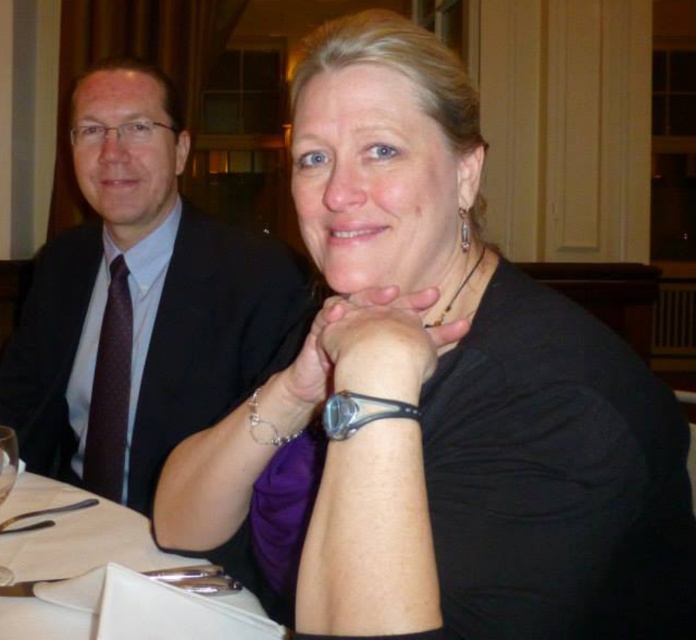
You are a photographer adjusting your camera settings to capture the scene. You notice the brown dotted tie at left and the silver metallic bracelet at lower center. Which object is located more to the left in the image?

The brown dotted tie at left is positioned on the left side of the silver metallic bracelet at lower center, so it is more to the left.

You are a fashion designer observing the formal attire of the person on the left. Which item, the matte black suit at left or the brown dotted tie at left, has a greater width?

The matte black suit at left has a greater width than the brown dotted tie at left according to the description.

You are a photographer standing behind the table. You want to take a photo that includes both the matte black suit at left and the black leather watch at center. What is the minimum distance you need to move backward from the table to ensure both objects are in frame?

To include both the matte black suit at left and the black leather watch at center, which are 88.89 centimeters apart, you need to move at least 88.89 centimeters backward from the table.